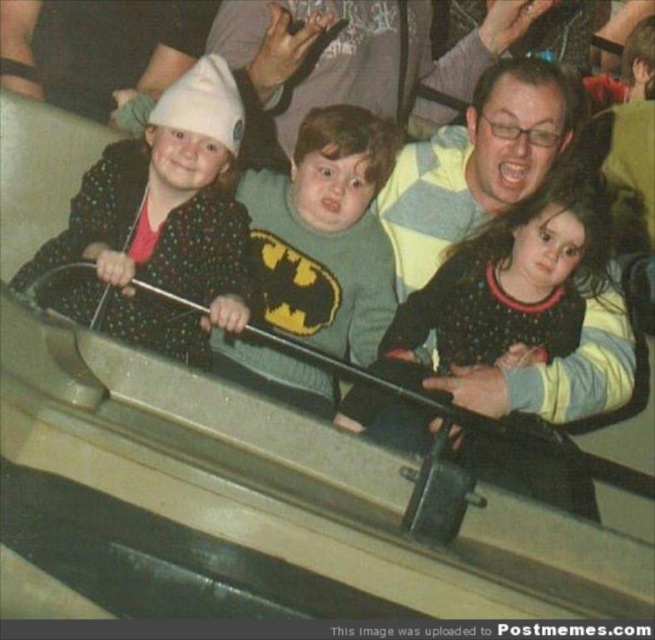
You are a photographer standing at the camera position. You want to take a photo of the child wearing the white dotted sweater at left. Is the child within the camera lens range of 3 meters?

The white dotted sweater at left and camera are 3.21 meters apart. Since the camera lens range is 3 meters, the child is slightly out of range. Move closer by 21 centimeters to capture the photo.

You are standing at the entrance of the amusement park and see the image. There is a point marked at coordinates (508, 288). What object is located at that point?

The point at coordinates (508, 288) marks the location of the polka dot sweater at center.